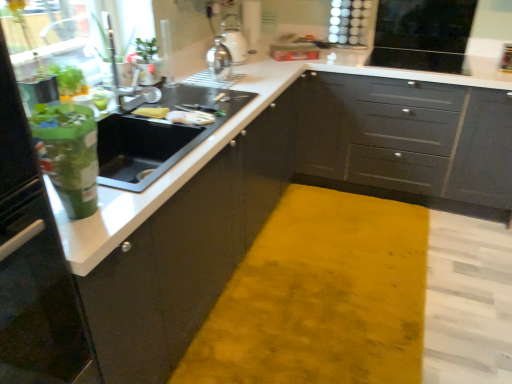
Question: Which direction should I rotate to face matte black cabinets at center, which is the 1th cabinetry from front to back, — up or down?

Choices:
 (A) up
 (B) down

Answer: (B)

Question: Can you confirm if satin silver kettle at upper center, placed as the 2th appliance when sorted from left to right, is smaller than matte gray cabinets at center, which appears as the 2th cabinetry when viewed from the front?

Choices:
 (A) yes
 (B) no

Answer: (A)

Question: Considering the relative sizes of satin silver kettle at upper center, the second appliance viewed from the right, and matte gray cabinets at center, which appears as the 2th cabinetry when viewed from the front, in the image provided, is satin silver kettle at upper center, the second appliance viewed from the right, shorter than matte gray cabinets at center, which appears as the 2th cabinetry when viewed from the front,?

Choices:
 (A) yes
 (B) no

Answer: (A)

Question: Would you say satin silver kettle at upper center, placed as the 2th appliance when sorted from left to right, is outside matte gray cabinets at center, which appears as the 2th cabinetry when viewed from the front?

Choices:
 (A) no
 (B) yes

Answer: (B)

Question: From a real-world perspective, is satin silver kettle at upper center, arranged as the 2th appliance when viewed from the front, located beneath matte gray cabinets at center, arranged as the 1th cabinetry when viewed from the back?

Choices:
 (A) no
 (B) yes

Answer: (A)

Question: Does satin silver kettle at upper center, arranged as the 2th appliance when viewed from the front, touch matte gray cabinets at center, which appears as the 2th cabinetry when viewed from the front?

Choices:
 (A) no
 (B) yes

Answer: (A)

Question: Is satin silver kettle at upper center, the second appliance viewed from the right, surrounding matte gray cabinets at center, which appears as the 2th cabinetry when viewed from the front?

Choices:
 (A) yes
 (B) no

Answer: (B)

Question: Is black glossy microwave at upper right, which is the first appliance in back-to-front order, thinner than matte black cabinets at center, arranged as the 2th cabinetry when viewed from the back?

Choices:
 (A) no
 (B) yes

Answer: (B)

Question: From a real-world perspective, is black glossy microwave at upper right, the 3th appliance from the front, physically below matte black cabinets at center, which is the 1th cabinetry from front to back?

Choices:
 (A) no
 (B) yes

Answer: (A)

Question: Does black glossy microwave at upper right, the 3th appliance from the front, have a lesser height compared to matte black cabinets at center, which is the 1th cabinetry from front to back?

Choices:
 (A) no
 (B) yes

Answer: (B)

Question: From a real-world perspective, is black glossy microwave at upper right, the 3th appliance from the front, located higher than matte black cabinets at center, which is the 1th cabinetry from front to back?

Choices:
 (A) no
 (B) yes

Answer: (B)

Question: Is black glossy microwave at upper right, which is the 3th appliance from left to right, positioned behind matte black cabinets at center, arranged as the 2th cabinetry when viewed from the back?

Choices:
 (A) yes
 (B) no

Answer: (A)

Question: From the image's perspective, is black glossy microwave at upper right, positioned as the first appliance in right-to-left order, located above matte black cabinets at center, arranged as the 2th cabinetry when viewed from the back?

Choices:
 (A) no
 (B) yes

Answer: (B)

Question: Is black glossy microwave at upper right, which is the first appliance in back-to-front order, inside matte black cabinets at center, which is the 1th cabinetry from front to back?

Choices:
 (A) no
 (B) yes

Answer: (A)